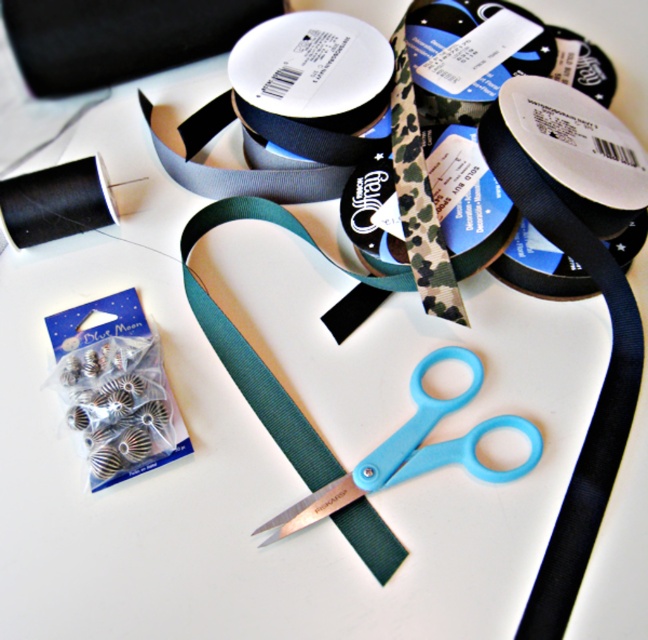
You are organizing a craft fair booth and need to display the matte black ribbon at upper center and the camo fabric tape at upper center. Based on their positions and sizes, which one should you place higher to ensure both are visible to customers?

The matte black ribbon at upper center is much taller than the camo fabric tape at upper center, so placing it higher would allow both to be visible without one blocking the other.

You need to choose between the black matte ribbon at upper right and the camo fabric tape at center for a project that requires a larger material. Which one should you pick?

The black matte ribbon at upper right has a larger size compared to the camo fabric tape at center, so you should pick the black matte ribbon at upper right.

You are standing 5 feet away from the crafting setup. Is the point at coordinates point (237,97) closer to you than your current position?

The distance of point (237,97) from camera is 4.48 feet, so yes, it is closer to you than your current position of 5 feet.